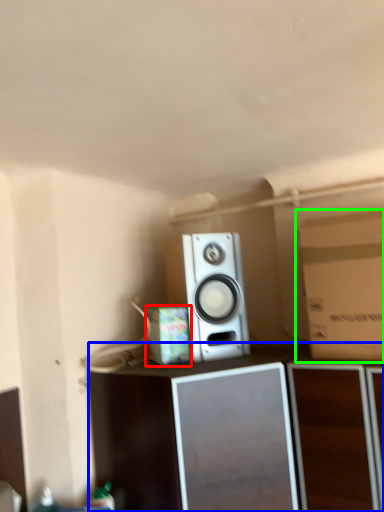
Question: Based on their relative distances, which object is nearer to cardboard box (highlighted by a red box)? Choose from furniture (highlighted by a blue box) and cardboard box (highlighted by a green box).

Choices:
 (A) furniture
 (B) cardboard box

Answer: (A)